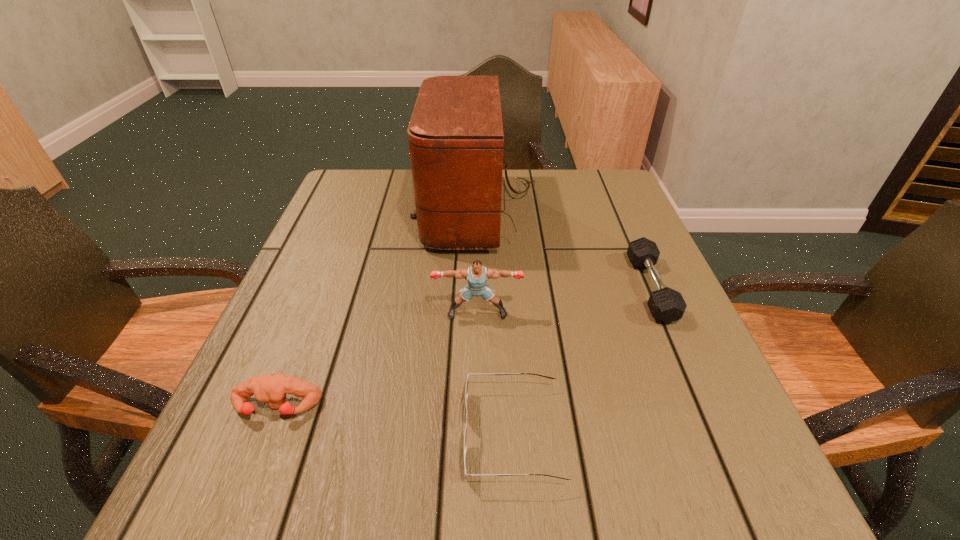
I want to click on vacant area at the left edge, so click(319, 433).

The width and height of the screenshot is (960, 540). In the image, there is a desktop. In order to click on free space at the right edge in this screenshot , I will do `click(735, 434)`.

In the image, there is a desktop. Where is `vacant space at the far left corner`? vacant space at the far left corner is located at coordinates click(x=326, y=205).

Find the location of a particular element. Image resolution: width=960 pixels, height=540 pixels. vacant space at the far right corner is located at coordinates (592, 191).

The height and width of the screenshot is (540, 960). I want to click on unoccupied position between the sunglasses and the radio receiver, so click(x=497, y=323).

I want to click on vacant point located between the nearer puncher and the farther puncher, so click(377, 360).

Identify the location of empty space that is in between the rightmost object and the fourth shortest object. This screenshot has height=540, width=960. (564, 301).

Locate an element on the screen. This screenshot has height=540, width=960. free space between the tallest object and the nearer puncher is located at coordinates (379, 310).

Image resolution: width=960 pixels, height=540 pixels. Identify the location of free space that is in between the shortest object and the tallest object. (497, 323).

Image resolution: width=960 pixels, height=540 pixels. What are the coordinates of `vacant region between the left puncher and the shortest object` in the screenshot? It's located at (396, 421).